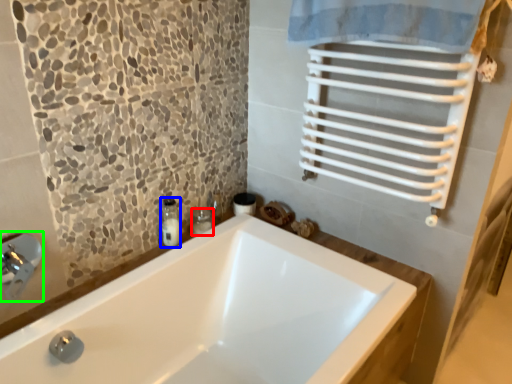
Question: Estimate the real-world distances between objects in this image. Which object is closer to toiletry (highlighted by a red box), soap dispenser (highlighted by a blue box) or faucet (highlighted by a green box)?

Choices:
 (A) soap dispenser
 (B) faucet

Answer: (A)